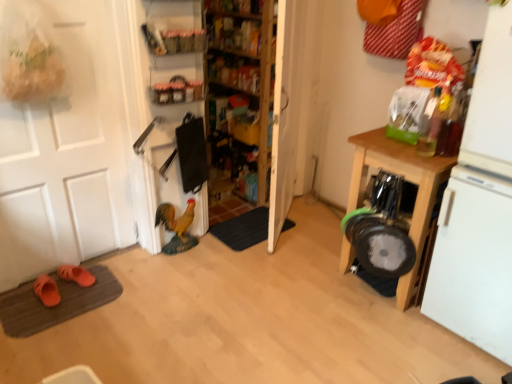
Question: Looking at the image, does white matte door at left seem bigger or smaller compared to dark gray carpet at center, which ranks as the second doormat in front-to-back order?

Choices:
 (A) big
 (B) small

Answer: (A)

Question: Considering the positions of white matte door at left and dark gray carpet at center, placed as the 2th doormat when sorted from bottom to top, in the image, is white matte door at left wider or thinner than dark gray carpet at center, placed as the 2th doormat when sorted from bottom to top,?

Choices:
 (A) thin
 (B) wide

Answer: (A)

Question: Based on their relative distances, which object is nearer to the brown textured doormat at lower left, the 1th doormat when ordered from bottom to top?

Choices:
 (A) wooden shelves at center, which is the third shelf from front to back
 (B) orange rubber slippers at lower left, positioned as the first footwear in front-to-back order
 (C) white matte door at left
 (D) white matte refrigerator at right
 (E) matte plastic shelf at upper center, which ranks as the first shelf in front-to-back order

Answer: (B)

Question: Considering the real-world distances, which object is closest to the orange suede slippers at lower left, which is the 2th footwear from front to back?

Choices:
 (A) matte plastic shelf at upper center, which is counted as the 3th shelf, starting from the back
 (B) white matte refrigerator at right
 (C) matte plastic shelf at upper center, the 2th shelf when ordered from front to back
 (D) white matte door at left
 (E) orange rubber slippers at lower left, acting as the 2th footwear starting from the back

Answer: (E)